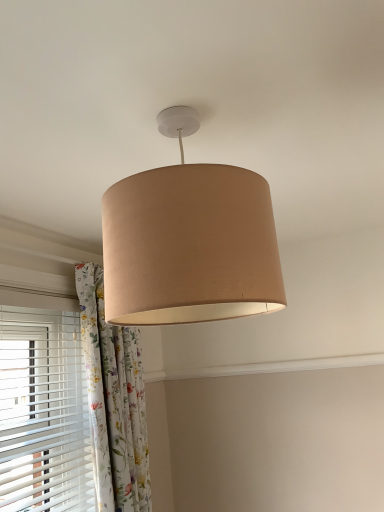
Question: From the image's perspective, is beige fabric lampshade at center positioned above or below floral fabric curtain at center?

Choices:
 (A) above
 (B) below

Answer: (A)

Question: From a real-world perspective, is beige fabric lampshade at center physically located above or below floral fabric curtain at center?

Choices:
 (A) below
 (B) above

Answer: (B)

Question: Looking at the image, does beige fabric lampshade at center seem bigger or smaller compared to floral fabric curtain at center?

Choices:
 (A) small
 (B) big

Answer: (A)

Question: Does point (94, 293) appear closer or farther from the camera than point (273, 252)?

Choices:
 (A) closer
 (B) farther

Answer: (B)

Question: Considering their positions, is floral fabric curtain at center located in front of or behind beige fabric lampshade at center?

Choices:
 (A) front
 (B) behind

Answer: (B)

Question: From the image's perspective, is floral fabric curtain at center positioned above or below beige fabric lampshade at center?

Choices:
 (A) below
 (B) above

Answer: (A)

Question: Is floral fabric curtain at center taller or shorter than beige fabric lampshade at center?

Choices:
 (A) tall
 (B) short

Answer: (A)